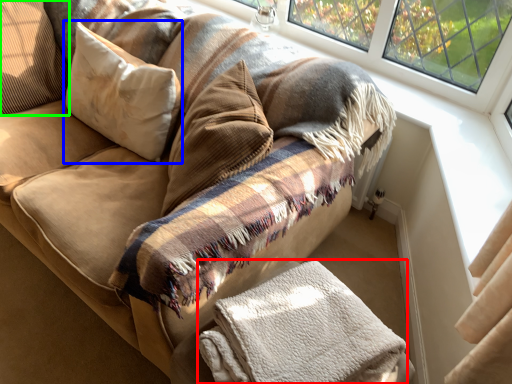
Question: Estimate the real-world distances between objects in this image. Which object is farther from material (highlighted by a red box), pillow (highlighted by a blue box) or pillow (highlighted by a green box)?

Choices:
 (A) pillow
 (B) pillow

Answer: (B)